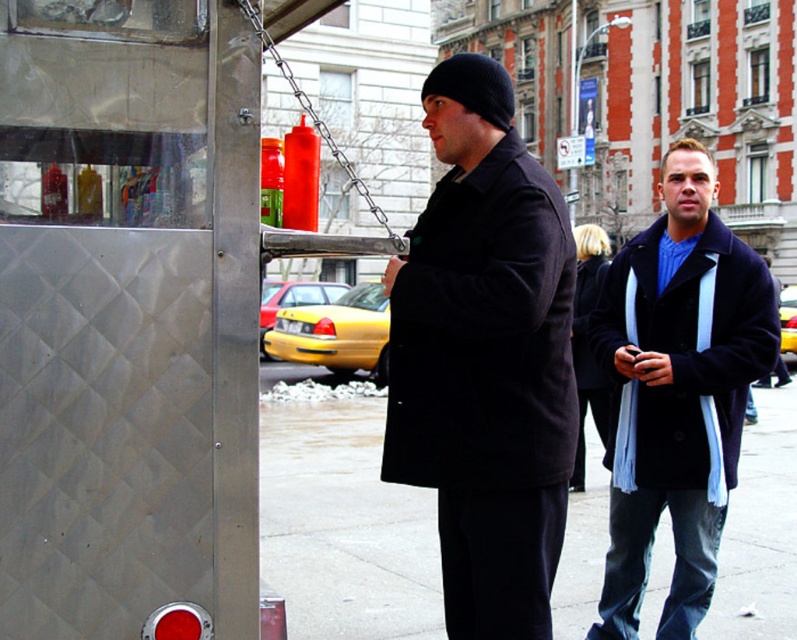
Question: Can you confirm if black wool coat at center is bigger than yellow matte taxi at center?

Choices:
 (A) yes
 (B) no

Answer: (B)

Question: Is concrete sidewalk at center below dark blue wool coat at right?

Choices:
 (A) yes
 (B) no

Answer: (A)

Question: Does dark blue wool coat at right have a larger size compared to yellow matte taxi at center?

Choices:
 (A) no
 (B) yes

Answer: (A)

Question: Among these points, which one is farthest from the camera?

Choices:
 (A) (379, 360)
 (B) (658, 570)
 (C) (725, 324)
 (D) (211, 596)

Answer: (A)

Question: Considering the real-world distances, which object is farthest from the dark blue wool coat at right?

Choices:
 (A) black wool coat at center
 (B) metallic diamond-patterned phone box at left
 (C) concrete sidewalk at center

Answer: (C)

Question: Estimate the real-world distances between objects in this image. Which object is farther from the concrete sidewalk at center?

Choices:
 (A) black wool coat at center
 (B) dark blue wool coat at right
 (C) yellow matte taxi at center
 (D) metallic diamond-patterned phone box at left

Answer: (B)